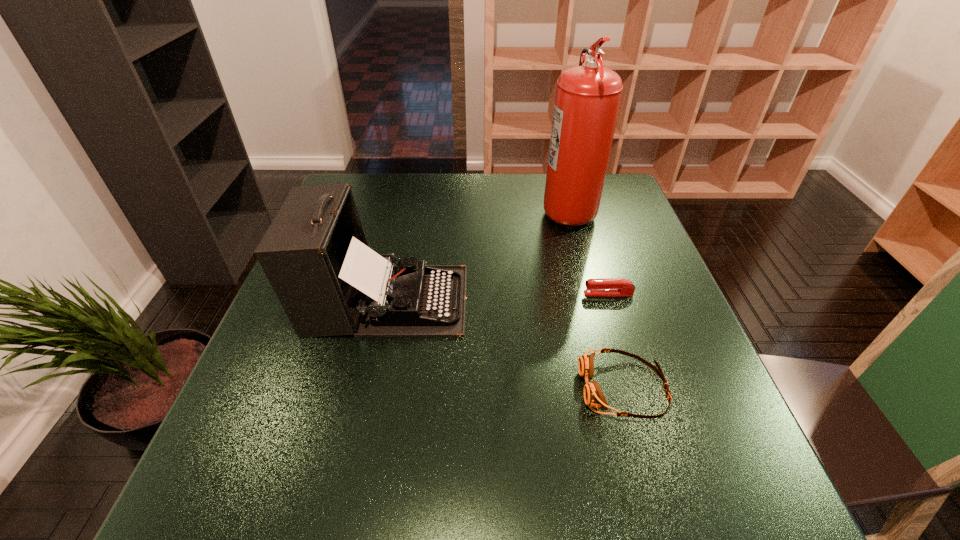
This screenshot has width=960, height=540. I want to click on free space located inside the open case of the leftmost object, so click(x=591, y=300).

You are a GUI agent. You are given a task and a screenshot of the screen. Output one action in this format:
    pyautogui.click(x=<x>, y=<y>)
    Task: Click on the vacant space located 0.130m with the lenses facing forward on the goggles
    Image resolution: width=960 pixels, height=540 pixels.
    Given the screenshot: What is the action you would take?
    pyautogui.click(x=514, y=388)

Find the location of `blank area located with the lenses facing forward on the goggles`. blank area located with the lenses facing forward on the goggles is located at coordinates (483, 388).

Find the location of a particular element. The height and width of the screenshot is (540, 960). vacant point located 0.240m with the lenses facing forward on the goggles is located at coordinates (457, 388).

Locate an element on the screen. This screenshot has height=540, width=960. free space located on the front-facing side of the stapler is located at coordinates (463, 293).

The height and width of the screenshot is (540, 960). Find the location of `free space located 0.080m on the front-facing side of the stapler`. free space located 0.080m on the front-facing side of the stapler is located at coordinates (551, 293).

Find the location of a particular element. The height and width of the screenshot is (540, 960). vacant space situated 0.190m on the front-facing side of the stapler is located at coordinates (504, 293).

This screenshot has height=540, width=960. Identify the location of object located in the far edge section of the desktop. (587, 100).

Image resolution: width=960 pixels, height=540 pixels. Identify the location of object that is at the left edge. (315, 254).

Locate an element on the screen. The height and width of the screenshot is (540, 960). fire extinguisher that is at the right edge is located at coordinates (587, 100).